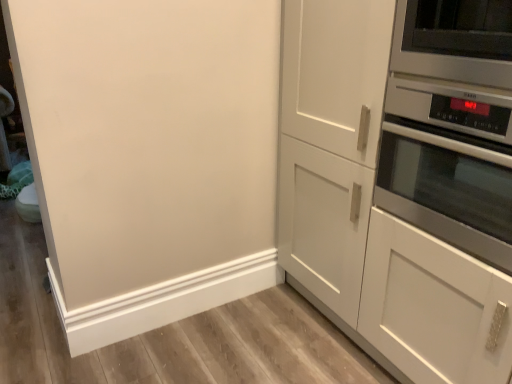
I want to click on stainless steel oven at right, so click(451, 125).

Where is `white matte cabinet at right`? This screenshot has width=512, height=384. white matte cabinet at right is located at coordinates (402, 179).

Describe the element at coordinates (402, 179) in the screenshot. I see `white matte cabinet at right` at that location.

Measure the distance between satin silver microwave at upper right and camera.

satin silver microwave at upper right and camera are 1.05 meters apart.

Describe the element at coordinates (455, 40) in the screenshot. I see `satin silver microwave at upper right` at that location.

The image size is (512, 384). In order to click on stainless steel oven at right in this screenshot , I will do [451, 125].

Can you see satin silver microwave at upper right touching stainless steel oven at right?

No, satin silver microwave at upper right is not next to stainless steel oven at right.

Is point (486, 28) positioned behind point (511, 94)?

Yes.

From a real-world perspective, is satin silver microwave at upper right physically located above or below stainless steel oven at right?

Clearly, from a real-world perspective, satin silver microwave at upper right is above stainless steel oven at right.

Measure the distance from satin silver microwave at upper right to stainless steel oven at right.

They are 4.12 inches apart.

From the image's perspective, between white matte cabinet at right and stainless steel oven at right, who is located below?

white matte cabinet at right.

Who is taller, white matte cabinet at right or stainless steel oven at right?

white matte cabinet at right is taller.

Is point (296, 124) positioned behind point (454, 181)?

Yes, point (296, 124) is farther from viewer.

Can you see white matte cabinet at right touching stainless steel oven at right?

No.

Locate an element on the screen. This screenshot has width=512, height=384. appliance positioned vertically above the white matte cabinet at right (from a real-world perspective) is located at coordinates (455, 40).

From a real-world perspective, is white matte cabinet at right physically located above or below satin silver microwave at upper right?

From a real-world perspective, white matte cabinet at right is physically below satin silver microwave at upper right.

In the scene shown: Would you say white matte cabinet at right is outside satin silver microwave at upper right?

Indeed, white matte cabinet at right is completely outside satin silver microwave at upper right.

Considering the relative sizes of white matte cabinet at right and satin silver microwave at upper right in the image provided, is white matte cabinet at right bigger than satin silver microwave at upper right?

Indeed, white matte cabinet at right has a larger size compared to satin silver microwave at upper right.

Considering their positions, is stainless steel oven at right located in front of or behind satin silver microwave at upper right?

In the image, stainless steel oven at right appears in front of satin silver microwave at upper right.

From a real-world perspective, which is physically above, stainless steel oven at right or satin silver microwave at upper right?

From a 3D spatial view, satin silver microwave at upper right is above.

Is point (407, 195) closer to viewer compared to point (507, 79)?

No, it is behind (507, 79).

Is stainless steel oven at right far from satin silver microwave at upper right?

No, there isn't a large distance between stainless steel oven at right and satin silver microwave at upper right.

Does point (511, 8) lie in front of point (337, 74)?

Yes, point (511, 8) is in front of point (337, 74).

What's the angular difference between stainless steel oven at right and white matte cabinet at right's facing directions?

There is a 0.000736-degree angle between the facing directions of stainless steel oven at right and white matte cabinet at right.

Based on the photo, how distant is stainless steel oven at right from white matte cabinet at right?

stainless steel oven at right is 4.62 inches away from white matte cabinet at right.

From their relative heights in the image, would you say stainless steel oven at right is taller or shorter than white matte cabinet at right?

stainless steel oven at right is shorter than white matte cabinet at right.

In the scene shown: From the image's perspective, is satin silver microwave at upper right positioned above or below white matte cabinet at right?

satin silver microwave at upper right is situated higher than white matte cabinet at right in the image.

From a real-world perspective, relative to white matte cabinet at right, is satin silver microwave at upper right vertically above or below?

satin silver microwave at upper right is situated higher than white matte cabinet at right in the real world.

Is satin silver microwave at upper right positioned with its back to white matte cabinet at right?

Yes, white matte cabinet at right is at the back of satin silver microwave at upper right.

Between satin silver microwave at upper right and white matte cabinet at right, which one has larger size?

white matte cabinet at right is bigger.

The height and width of the screenshot is (384, 512). Find the location of `home appliance below the satin silver microwave at upper right (from the image's perspective)`. home appliance below the satin silver microwave at upper right (from the image's perspective) is located at coordinates (451, 125).

I want to click on home appliance lying behind the white matte cabinet at right, so click(x=451, y=125).

Which object lies further to the anchor point stainless steel oven at right, white matte cabinet at right or satin silver microwave at upper right?

The object further to stainless steel oven at right is white matte cabinet at right.

From the image, which object appears to be nearer to white matte cabinet at right, stainless steel oven at right or satin silver microwave at upper right?

stainless steel oven at right is positioned closer to the anchor white matte cabinet at right.

Looking at the image, which one is located further to satin silver microwave at upper right, white matte cabinet at right or stainless steel oven at right?

white matte cabinet at right.

Which object lies further to the anchor point satin silver microwave at upper right, stainless steel oven at right or white matte cabinet at right?

white matte cabinet at right.

Based on their spatial positions, is satin silver microwave at upper right or stainless steel oven at right closer to white matte cabinet at right?

The object closer to white matte cabinet at right is stainless steel oven at right.

Which object lies further to the anchor point stainless steel oven at right, satin silver microwave at upper right or white matte cabinet at right?

white matte cabinet at right is further to stainless steel oven at right.

Image resolution: width=512 pixels, height=384 pixels. I want to click on home appliance between satin silver microwave at upper right and white matte cabinet at right vertically, so 451,125.